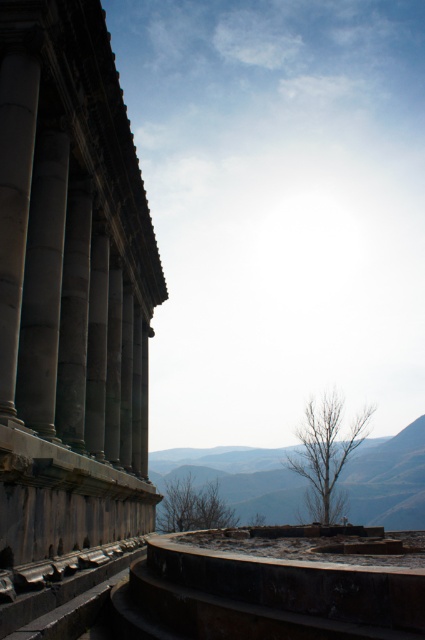
Who is lower down, gray stone columns at left or smooth stone column at left?

gray stone columns at left is below.

Can you confirm if gray stone columns at left is positioned to the left of smooth stone column at left?

In fact, gray stone columns at left is to the right of smooth stone column at left.

Which is in front, point (47, 369) or point (8, 248)?

Point (8, 248) is in front.

Locate an element on the screen. This screenshot has height=640, width=425. gray stone columns at left is located at coordinates (70, 289).

Based on the photo, does gray stone mountain at center have a lesser width compared to slate gray stone column at left?

Incorrect, gray stone mountain at center's width is not less than slate gray stone column at left's.

Is gray stone mountain at center taller than slate gray stone column at left?

Indeed, gray stone mountain at center has a greater height compared to slate gray stone column at left.

What do you see at coordinates (240, 481) in the screenshot?
I see `gray stone mountain at center` at bounding box center [240, 481].

Find the location of a particular element. Image resolution: width=425 pixels, height=640 pixels. gray stone mountain at center is located at coordinates (240, 481).

Can you confirm if slate gray stone column at left is wider than smooth stone column at left?

Yes.

Does slate gray stone column at left appear on the right side of smooth stone column at left?

Indeed, slate gray stone column at left is positioned on the right side of smooth stone column at left.

The image size is (425, 640). Describe the element at coordinates (42, 284) in the screenshot. I see `slate gray stone column at left` at that location.

The height and width of the screenshot is (640, 425). What are the coordinates of `slate gray stone column at left` in the screenshot? It's located at (42, 284).